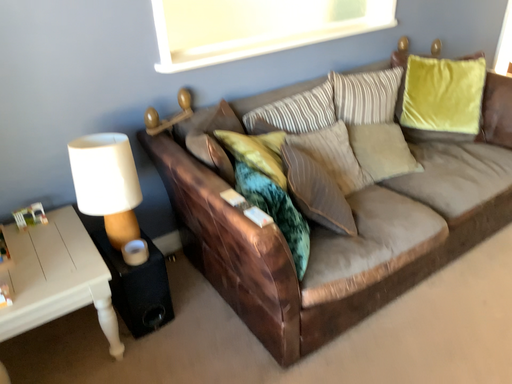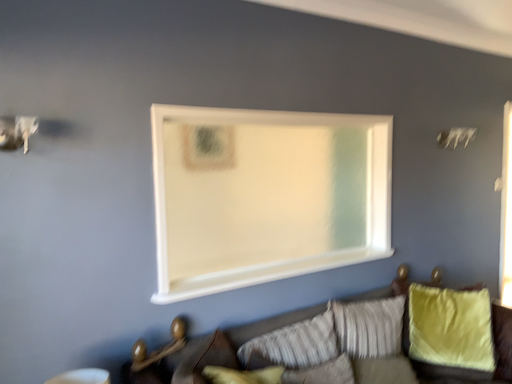
Question: Which way did the camera rotate in the video?

Choices:
 (A) rotated upward
 (B) rotated downward

Answer: (A)